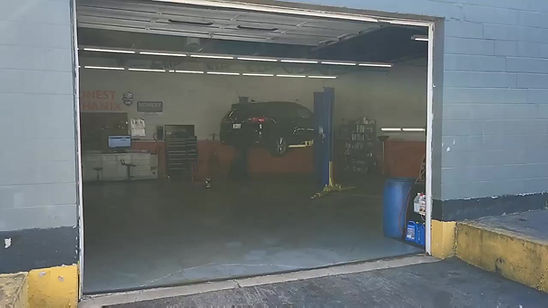
The image size is (548, 308). I want to click on shelving against wall, so click(x=365, y=125), click(x=366, y=143), click(x=358, y=164).